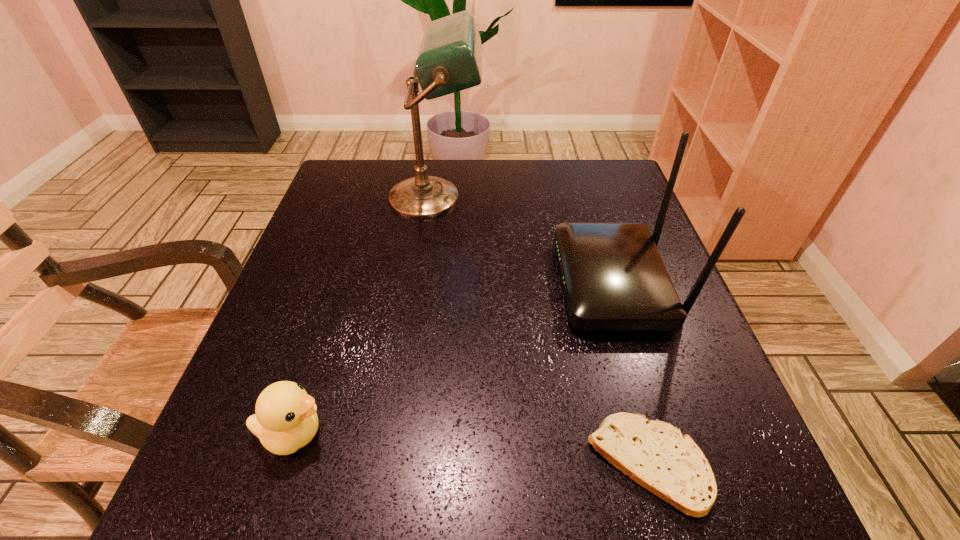
Where is `table lamp`? The image size is (960, 540). table lamp is located at coordinates (449, 60).

Image resolution: width=960 pixels, height=540 pixels. What are the coordinates of `the farthest object` in the screenshot? It's located at click(x=449, y=60).

Find the location of a particular element. Image resolution: width=960 pixels, height=540 pixels. the third nearest object is located at coordinates (614, 279).

Where is `the third shortest object`? The image size is (960, 540). the third shortest object is located at coordinates 614,279.

Where is `the second shortest object`? the second shortest object is located at coordinates (285, 419).

In order to click on the shortest object in this screenshot , I will do `click(654, 454)`.

Locate an element on the screen. free region located above the green lampshade of the farthest object is located at coordinates point(540,197).

In order to click on vacant space situated 0.320m on the front-facing side of the second tallest object in this screenshot , I will do `click(404, 283)`.

You are a GUI agent. You are given a task and a screenshot of the screen. Output one action in this format:
    pyautogui.click(x=<x>, y=<y>)
    Task: Click on the vacant space located 0.320m on the front-facing side of the second tallest object
    The height and width of the screenshot is (540, 960).
    Given the screenshot: What is the action you would take?
    pyautogui.click(x=404, y=283)

Where is `vacant point located 0.240m on the front-facing side of the second tallest object`? vacant point located 0.240m on the front-facing side of the second tallest object is located at coordinates coord(443,283).